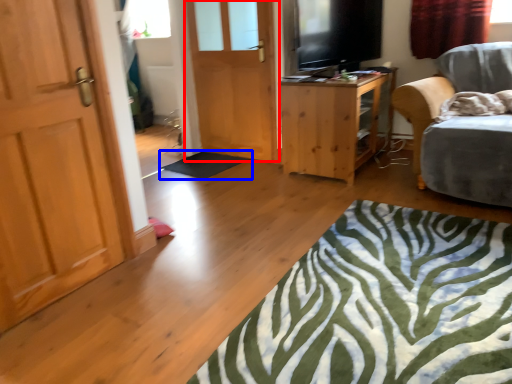
Question: Which object is closer to the camera taking this photo, door (highlighted by a red box) or flat (highlighted by a blue box)?

Choices:
 (A) door
 (B) flat

Answer: (A)